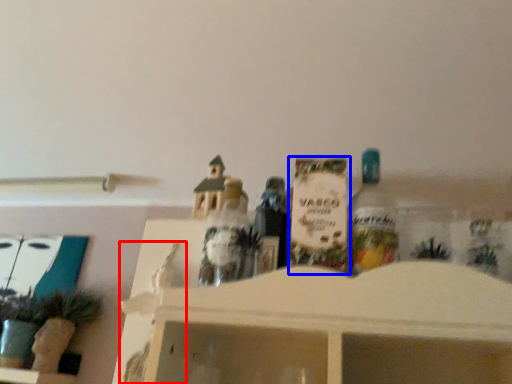
Question: Which object is closer to the camera taking this photo, toy (highlighted by a red box) or toy (highlighted by a blue box)?

Choices:
 (A) toy
 (B) toy

Answer: (B)